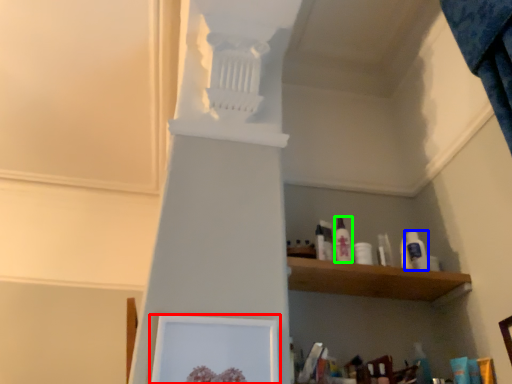
Question: Based on their relative distances, which object is nearer to picture frame (highlighted by a red box)? Choose from toiletry (highlighted by a blue box) and toiletry (highlighted by a green box).

Choices:
 (A) toiletry
 (B) toiletry

Answer: (B)